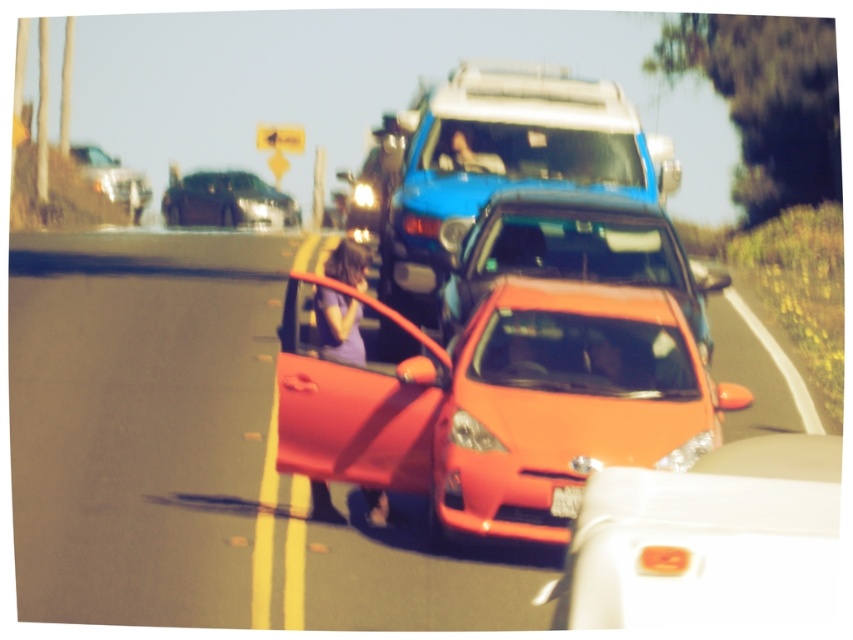
You are a pedestrian standing on the sidewalk and see the shiny orange car at center and the shiny orange sedan at center. Which one is more to the left?

The shiny orange car at center is positioned on the left side of the shiny orange sedan at center, so it is more to the left.

You are a delivery driver who needs to park your truck between the shiny orange car at center and the shiny orange sedan at center. Can your truck fit in the space between them?

The shiny orange car at center is wider than the shiny orange sedan at center, so the space between them may vary depending on their exact positioning. However, without knowing the exact distance between them or the width of your truck, it is impossible to determine if it will fit.

You are a delivery driver who needs to park your vehicle in a parking spot that has a shiny orange car at center and a white plastic license plate at center. According to the scene, can you park your car here without overlapping any existing objects?

The shiny orange car at center is positioned over the white plastic license plate at center, meaning the parking spot is already occupied by the shiny orange car at center. Therefore, you cannot park here without overlapping existing objects.